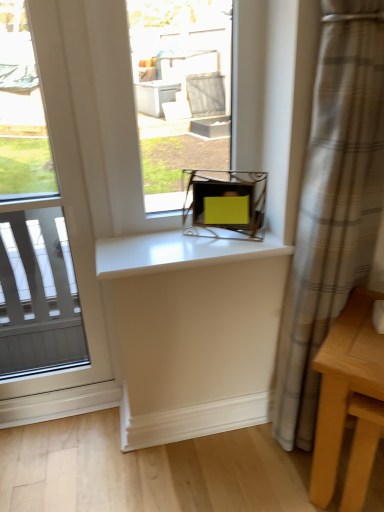
This screenshot has width=384, height=512. Find the location of `vacant space to the left of light wood table at lower right`. vacant space to the left of light wood table at lower right is located at coordinates (254, 473).